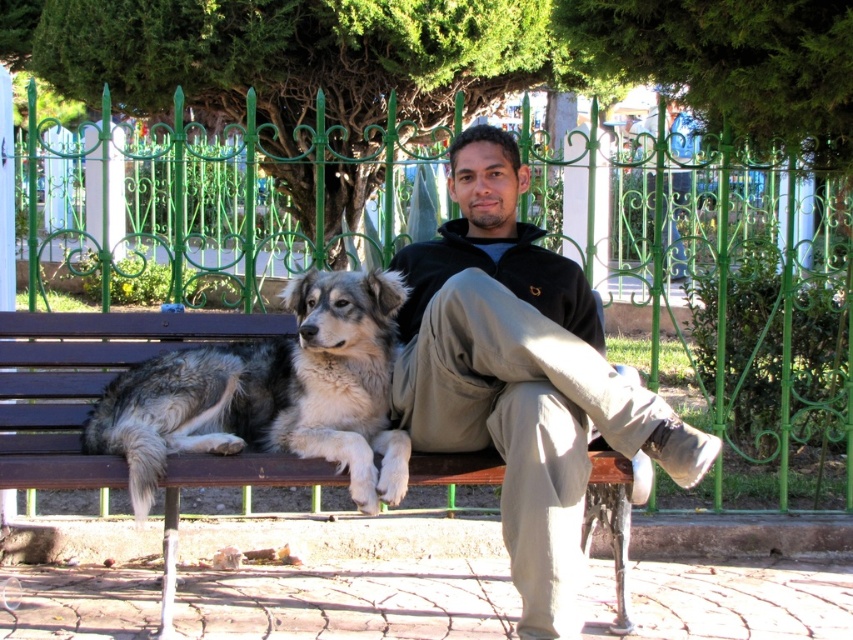
From the picture: You are a photographer trying to capture the black fleece jacket at center in your shot. The camera is positioned at point 0.5, 0.5. Can you tell me the direction you need to move the camera to frame the jacket properly?

The black fleece jacket at center is located at point (521, 376). Since the camera is at (426, 320), you need to move the camera slightly to the right and upwards to align with the jacket.

You are standing in front of the bench and want to place a small flowerpot between the two points marked as point (267, 394) and point (180, 470). Can you determine which point is closer to you so you can place the flowerpot correctly?

Point (180, 470) is closer to you than point (267, 394), so you should place the flowerpot near point (180, 470) to ensure it is between them.